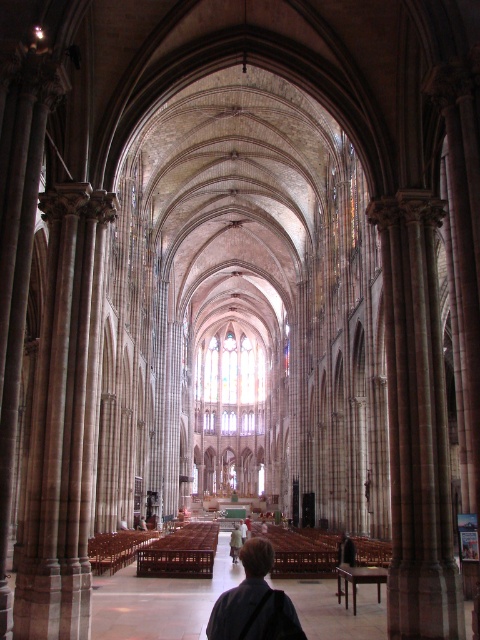
You are standing in the cathedral and notice the brown stone pillar at right and the dark brown hair at center. Which object is closer to you?

The brown stone pillar at right is closer to you than the dark brown hair at center because it is further to the viewer.

You are standing at the entrance of the cathedral and want to take a photo of the brown stone pillar at left. If the camera has a focal length of 50mm and the pillar is located at coordinates corresponding to the point mentioned in the description, would the pillar be in the center of the photo?

The brown stone pillar at left is located at coordinates approximately 0.658 on the x axis and 0.131 on the y axis. Since the center of the photo would be at coordinates around 0.5 on both axes, the pillar is shifted to the right and slightly downward from the center. Therefore, it would not be centered in the photo.